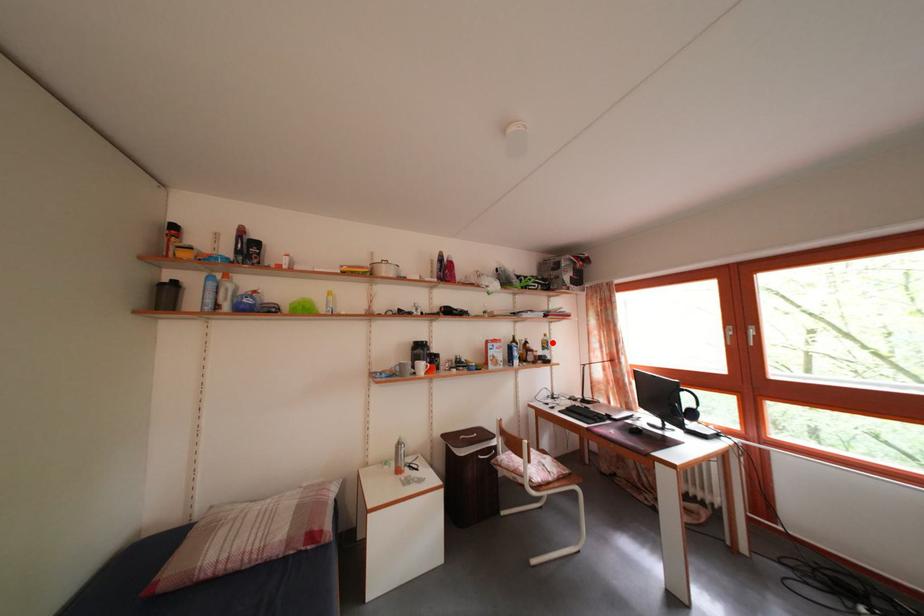
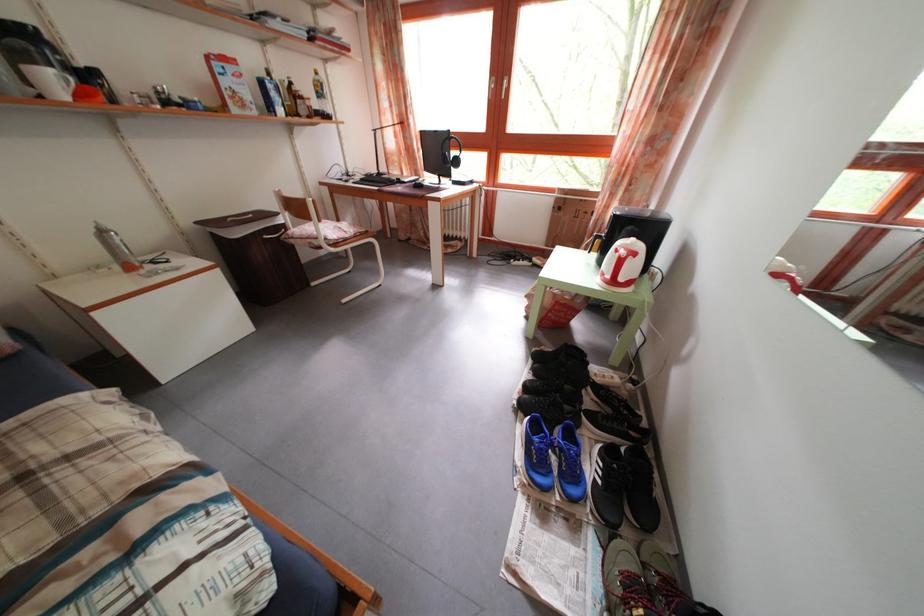
Where in the second image is the point corresponding to the highlighted location from the first image?

(323, 79)